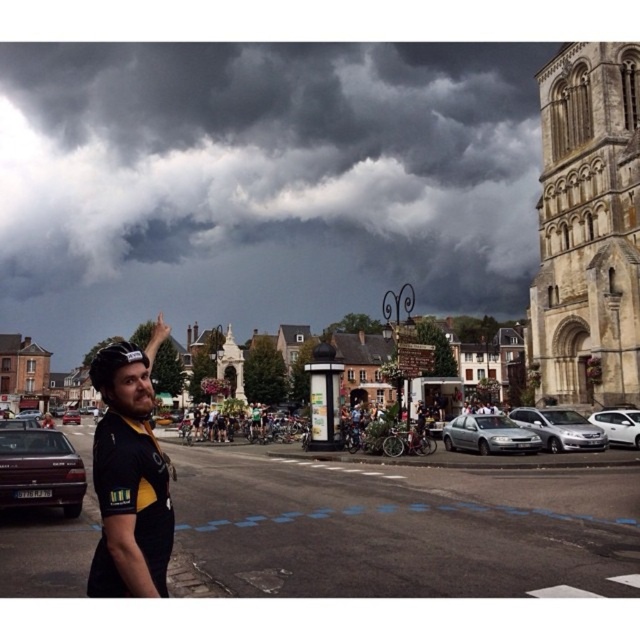
Consider the image. Does silver metallic sedan at center-right lie behind matte black car at left?

No.

Does silver metallic sedan at center-right lie in front of matte black car at left?

Yes, it is in front of matte black car at left.

Is point (536, 442) in front of point (74, 410)?

Yes, point (536, 442) is closer to viewer.

You are a GUI agent. You are given a task and a screenshot of the screen. Output one action in this format:
    pyautogui.click(x=<x>, y=<y>)
    Task: Click on the silver metallic sedan at center-right
    
    Given the screenshot: What is the action you would take?
    (488, 435)

What do you see at coordinates (129, 476) in the screenshot?
I see `black jersey at left` at bounding box center [129, 476].

Can you confirm if black jersey at left is thinner than satin silver sedan at center?

In fact, black jersey at left might be wider than satin silver sedan at center.

The width and height of the screenshot is (640, 640). Identify the location of black jersey at left. (129, 476).

Who is positioned more to the left, silver metallic sedan at center-right or white glossy sedan at right?

Positioned to the left is silver metallic sedan at center-right.

Is point (452, 445) more distant than point (589, 419)?

Yes.

Find the location of `silver metallic sedan at center-right`. silver metallic sedan at center-right is located at coordinates (488, 435).